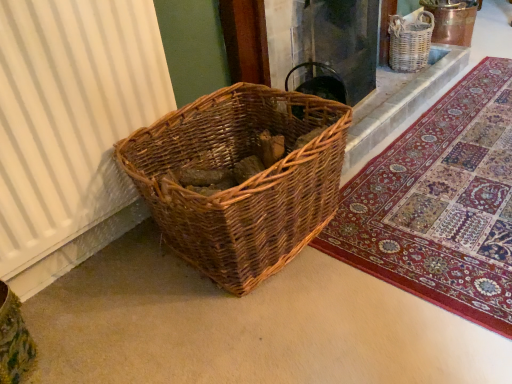
Question: Is point (402, 67) positioned closer to the camera than point (326, 87)?

Choices:
 (A) farther
 (B) closer

Answer: (A)

Question: Considering the positions of woven brown basket at upper right and woven wood basket at upper center in the image, is woven brown basket at upper right wider or thinner than woven wood basket at upper center?

Choices:
 (A) wide
 (B) thin

Answer: (B)

Question: Which object is positioned closest to the woven wood basket at lower left?

Choices:
 (A) woven wood basket at upper center
 (B) rich tapestry rug at lower right
 (C) white ribbed curtain at left
 (D) woven brown basket at upper right

Answer: (C)

Question: Which of these objects is positioned farthest from the woven wood basket at lower left?

Choices:
 (A) white ribbed curtain at left
 (B) rich tapestry rug at lower right
 (C) woven wood basket at upper center
 (D) woven brown basket at upper right

Answer: (D)